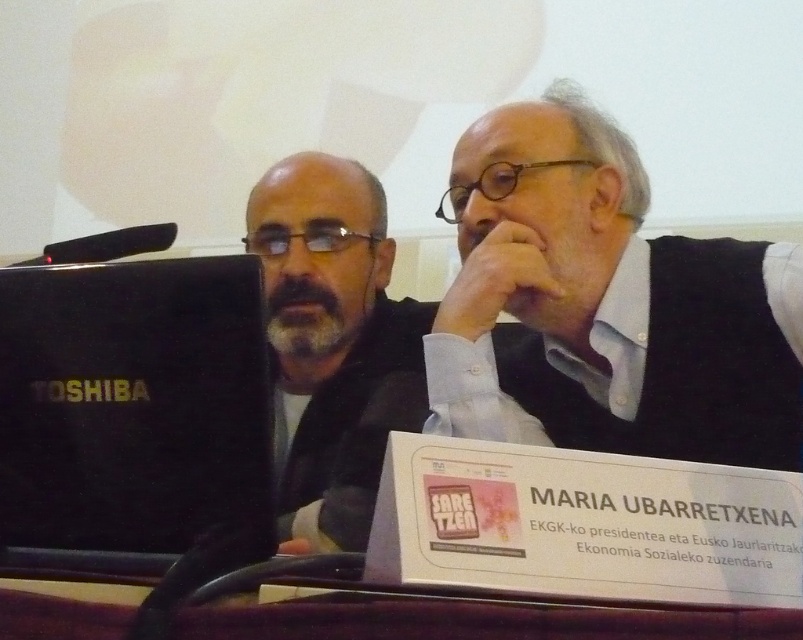
You are organizing a meeting and need to place two laptops on a table. There is a black matte laptop at left and a matte black laptop at left. According to the image, which laptop should be placed to the left side of the table?

The black matte laptop at left should be placed to the left side of the table because it is positioned to the left of the matte black laptop at left in the image.

You are organizing a meeting and need to place a 12cm tall document holder between the black matte laptop at left and the gray beard at center. Can you fit it vertically between them without tilting?

The black matte laptop at left is much taller than the gray beard at center. Since the document holder is 12cm tall, it may not fit vertically between them if the space between the laptop and beard is less than 12cm. However, the exact height difference isn not specified, so we cannot confirm without more information.

You are an assistant at a conference. You need to place a small plant between the two points labeled point (294, 221) and point (312, 291). According to their positions, which point should the plant be closer to?

Point (294, 221) is behind point (312, 291), so the plant should be placed closer to point (312, 291) to ensure it is in front of both points.